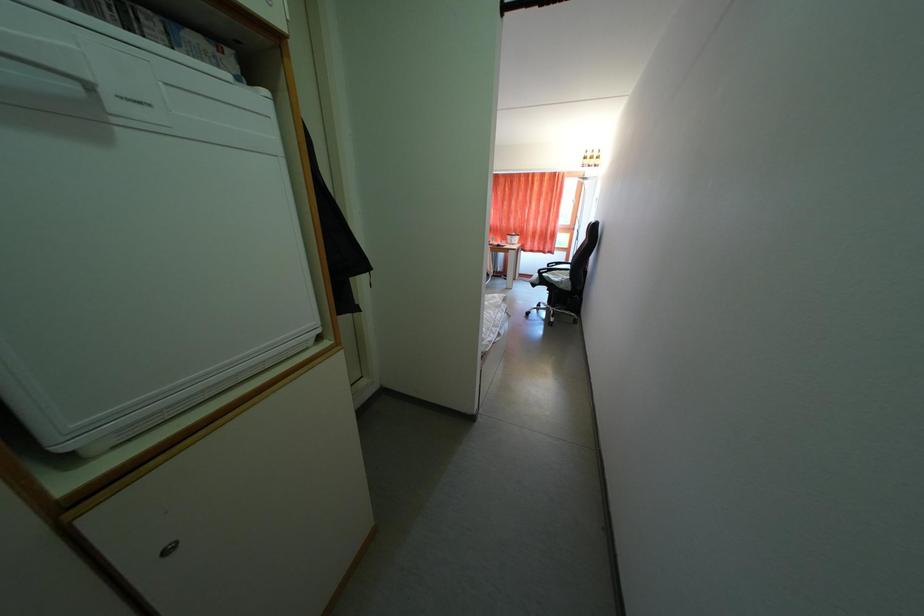
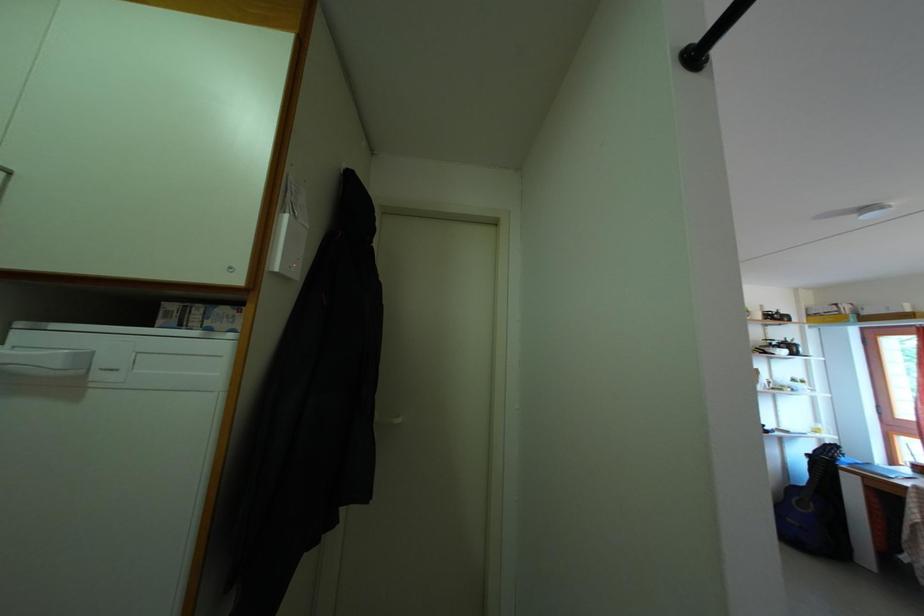
How did the camera likely rotate?

The rotation direction of the camera is left-up.